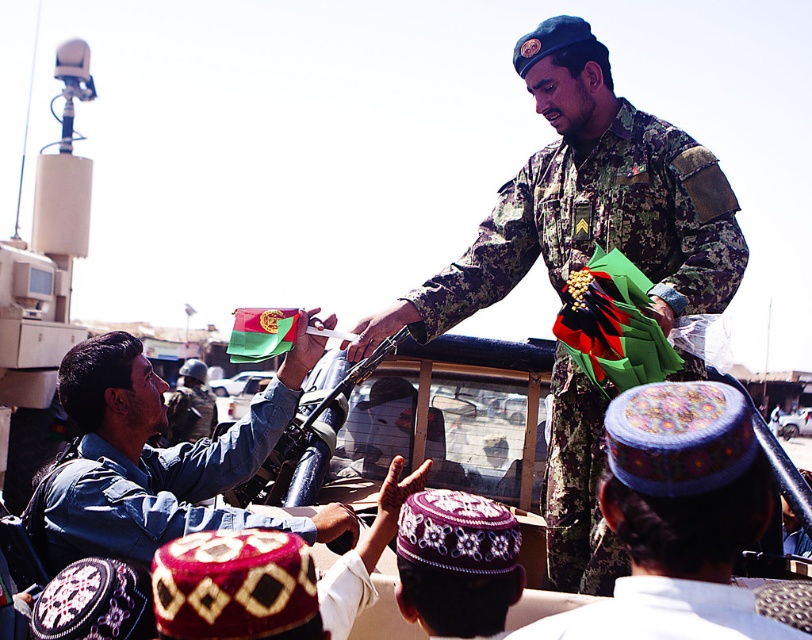
Question: Among these objects, which one is nearest to the camera?

Choices:
 (A) metallic silver vehicle at center
 (B) embroidered wool cap at center
 (C) camouflage fabric uniform at upper center

Answer: (B)

Question: Does purple embroidered cap at center appear over metallic silver vehicle at center?

Choices:
 (A) yes
 (B) no

Answer: (A)

Question: Is purple embroidered cap at center thinner than white textured cloth at lower right?

Choices:
 (A) yes
 (B) no

Answer: (A)

Question: Is camouflage fabric uniform at upper center further to the viewer compared to metallic silver vehicle at center?

Choices:
 (A) yes
 (B) no

Answer: (B)

Question: Estimate the real-world distances between objects in this image. Which object is closer to the denim jacket at left?

Choices:
 (A) camouflage fabric uniform at upper center
 (B) white textured cloth at lower right
 (C) metallic silver vehicle at center

Answer: (B)

Question: Which object is farther from the camera taking this photo?

Choices:
 (A) camouflage fabric uniform at upper center
 (B) camouflage fabric uniform at center

Answer: (A)